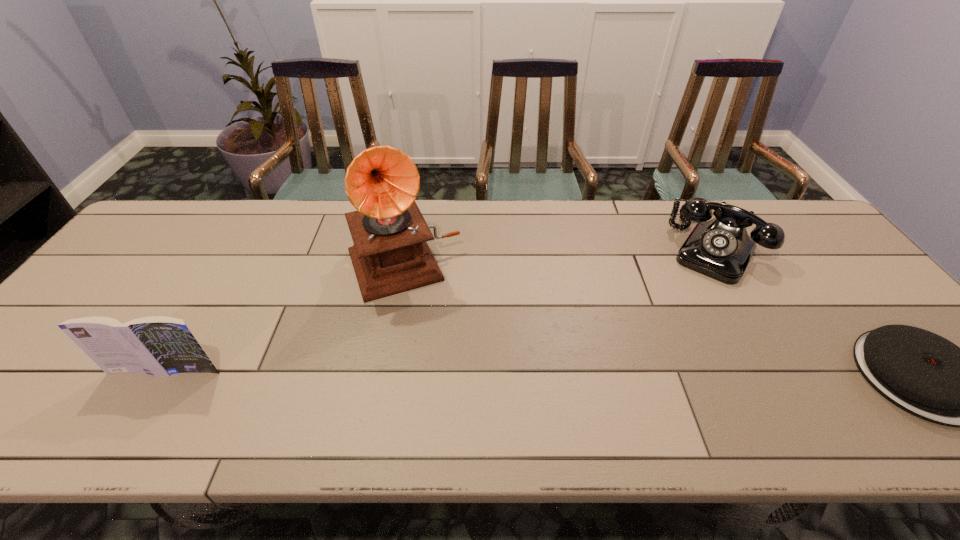
Find the location of a particular element. vacant spot on the desktop that is between the leftmost object and the rightmost object and is positioned on the dial of the telephone is located at coordinates (640, 374).

The image size is (960, 540). Identify the location of free space on the desktop that is between the third shortest object and the shortest object and is positioned on the horn of the third object from right to left. (446, 373).